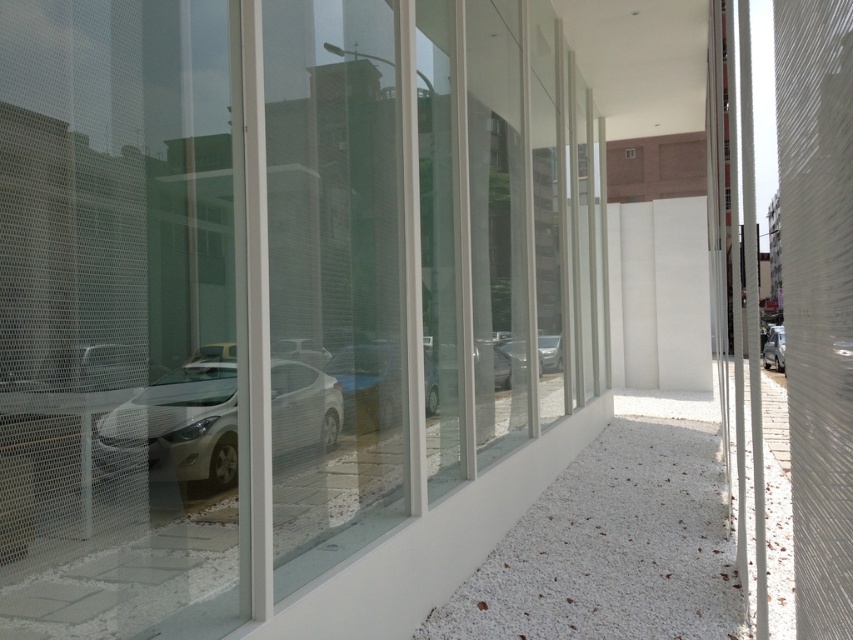
You are standing in front of the building and want to know which car is closer to the entrance. Based on the image, which car is positioned higher up, the white glossy car at left or the metallic silver car at right?

The white glossy car at left is located above the metallic silver car at right, meaning it is positioned higher up and likely closer to the entrance.